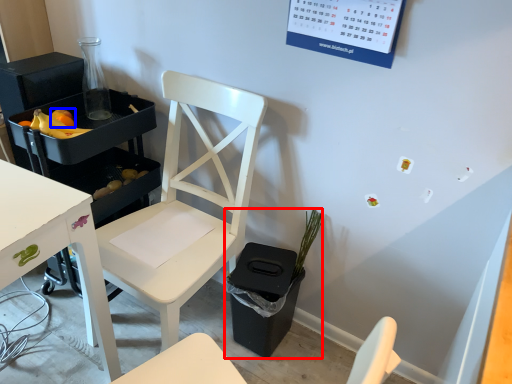
Question: Among these objects, which one is farthest to the camera, houseplant (highlighted by a red box) or fruit (highlighted by a blue box)?

Choices:
 (A) houseplant
 (B) fruit

Answer: (B)